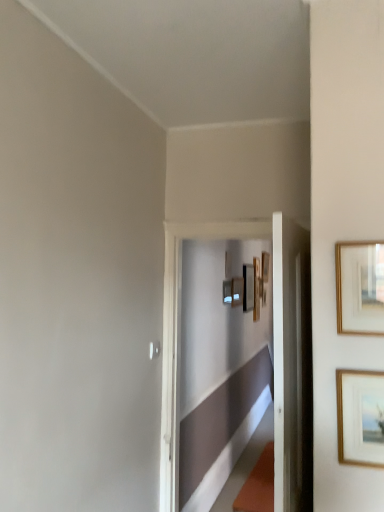
From the picture: Measure the distance between matte black picture frame at center, which is the third picture frame from front to back, and camera.

The distance of matte black picture frame at center, which is the third picture frame from front to back, from camera is 4.00 meters.

Locate an element on the screen. wooden picture frame at center, which ranks as the 1th picture frame in back-to-front order is located at coordinates (256, 289).

This screenshot has height=512, width=384. Find the location of `matte black picture frame at center, which appears as the 5th picture frame when viewed from the front`. matte black picture frame at center, which appears as the 5th picture frame when viewed from the front is located at coordinates (248, 287).

In order to click on gold-framed picture at right, the first picture frame when ordered from front to back in this screenshot , I will do `click(359, 417)`.

Where is `matte black picture frame at center, which is counted as the 4th picture frame, starting from the back`? This screenshot has width=384, height=512. matte black picture frame at center, which is counted as the 4th picture frame, starting from the back is located at coordinates (227, 291).

From the image's perspective, is wooden picture frame at center, the fourth picture frame when ordered from front to back, above or below wooden picture frame at center, which ranks as the 1th picture frame in back-to-front order?

wooden picture frame at center, the fourth picture frame when ordered from front to back, is situated higher than wooden picture frame at center, which ranks as the 1th picture frame in back-to-front order, in the image.

Considering the relative sizes of wooden picture frame at center, which appears as the third picture frame when viewed from the back, and wooden picture frame at center, which ranks as the 1th picture frame in back-to-front order, in the image provided, is wooden picture frame at center, which appears as the third picture frame when viewed from the back, thinner than wooden picture frame at center, which ranks as the 1th picture frame in back-to-front order,?

Yes.

From a real-world perspective, is wooden picture frame at center, the fourth picture frame when ordered from front to back, physically below wooden picture frame at center, the sixth picture frame when ordered from front to back?

No, from a real-world perspective, wooden picture frame at center, the fourth picture frame when ordered from front to back, is not under wooden picture frame at center, the sixth picture frame when ordered from front to back.

Can you confirm if gold-framed picture at right, the first picture frame when ordered from front to back, is wider than matte black picture frame at center, the second picture frame when ordered from back to front?

Incorrect, the width of gold-framed picture at right, the first picture frame when ordered from front to back, does not surpass that of matte black picture frame at center, the second picture frame when ordered from back to front.

Does gold-framed picture at right, the first picture frame when ordered from front to back, appear on the left side of matte black picture frame at center, which appears as the 5th picture frame when viewed from the front?

Yes.

Is gold-framed picture at right, the 6th picture frame from the back, positioned with its back to matte black picture frame at center, the second picture frame when ordered from back to front?

Yes, matte black picture frame at center, the second picture frame when ordered from back to front, is at the back of gold-framed picture at right, the 6th picture frame from the back.

Would you say gold-framed picture at right, the 6th picture frame from the back, is inside or outside matte black picture frame at center, which appears as the 5th picture frame when viewed from the front?

gold-framed picture at right, the 6th picture frame from the back, is not enclosed by matte black picture frame at center, which appears as the 5th picture frame when viewed from the front.

Is gold-framed picture at right, the 6th picture frame from the back, taller than wooden picture frame at center, the sixth picture frame when ordered from front to back?

No.

Who is more distant, gold-framed picture at right, the first picture frame when ordered from front to back, or wooden picture frame at center, the sixth picture frame when ordered from front to back?

wooden picture frame at center, the sixth picture frame when ordered from front to back, is behind.

Which is less distant, (356, 412) or (253, 320)?

Point (356, 412)

Are gold-framed picture at right, the first picture frame when ordered from front to back, and gold-framed picture at upper right, marked as the 2th picture frame in a front-to-back arrangement, beside each other?

gold-framed picture at right, the first picture frame when ordered from front to back, and gold-framed picture at upper right, marked as the 2th picture frame in a front-to-back arrangement, are not in contact.

Would you say gold-framed picture at right, the 6th picture frame from the back, is to the left or to the right of gold-framed picture at upper right, positioned as the 5th picture frame in back-to-front order, in the picture?

gold-framed picture at right, the 6th picture frame from the back, is to the left of gold-framed picture at upper right, positioned as the 5th picture frame in back-to-front order.

From the gold-framed picture at right, the first picture frame when ordered from front to back, count 1st picture frames backward and point to it. Please provide its 2D coordinates.

[(360, 287)]

Between gold-framed picture at right, the first picture frame when ordered from front to back, and gold-framed picture at upper right, positioned as the 5th picture frame in back-to-front order, which one is positioned in front?

gold-framed picture at right, the first picture frame when ordered from front to back.

Considering the sizes of objects wooden picture frame at center, the fourth picture frame when ordered from front to back, and matte black picture frame at center, which is counted as the 4th picture frame, starting from the back, in the image provided, who is wider, wooden picture frame at center, the fourth picture frame when ordered from front to back, or matte black picture frame at center, which is counted as the 4th picture frame, starting from the back,?

Wider between the two is wooden picture frame at center, the fourth picture frame when ordered from front to back.

Can you tell me how much wooden picture frame at center, which appears as the third picture frame when viewed from the back, and matte black picture frame at center, which is the third picture frame from front to back, differ in facing direction?

0.0101 degrees.

Is point (241, 290) in front of point (226, 297)?

No.

Does wooden picture frame at center, which appears as the third picture frame when viewed from the back, have a smaller size compared to matte black picture frame at center, which is the third picture frame from front to back?

No, wooden picture frame at center, which appears as the third picture frame when viewed from the back, is not smaller than matte black picture frame at center, which is the third picture frame from front to back.

From a real-world perspective, which picture frame is the 1st one above the gold-framed picture at right, the first picture frame when ordered from front to back? Please provide its 2D coordinates.

[(227, 291)]

Is point (356, 434) farther from camera compared to point (225, 286)?

No, it is in front of (225, 286).

Is gold-framed picture at right, the 6th picture frame from the back, taller or shorter than matte black picture frame at center, which is counted as the 4th picture frame, starting from the back?

gold-framed picture at right, the 6th picture frame from the back, is taller than matte black picture frame at center, which is counted as the 4th picture frame, starting from the back.

Can you tell me how much matte black picture frame at center, which is the third picture frame from front to back, and matte black picture frame at center, which appears as the 5th picture frame when viewed from the front, differ in facing direction?

The angle between the facing direction of matte black picture frame at center, which is the third picture frame from front to back, and the facing direction of matte black picture frame at center, which appears as the 5th picture frame when viewed from the front, is 0.0116 degrees.

From a real-world perspective, is matte black picture frame at center, which is the third picture frame from front to back, physically below matte black picture frame at center, the second picture frame when ordered from back to front?

Yes, from a real-world perspective, matte black picture frame at center, which is the third picture frame from front to back, is below matte black picture frame at center, the second picture frame when ordered from back to front.

Is matte black picture frame at center, which is counted as the 4th picture frame, starting from the back, positioned with its back to matte black picture frame at center, the second picture frame when ordered from back to front?

No, matte black picture frame at center, which is counted as the 4th picture frame, starting from the back, is not facing away from matte black picture frame at center, the second picture frame when ordered from back to front.

Locate an element on the screen. The height and width of the screenshot is (512, 384). picture frame that is the 1st object located below the wooden picture frame at center, the fourth picture frame when ordered from front to back (from the image's perspective) is located at coordinates (256, 289).

Find the location of `picture frame that is the 3rd one when counting upward from the gold-framed picture at right, the first picture frame when ordered from front to back (from the image's perspective)`. picture frame that is the 3rd one when counting upward from the gold-framed picture at right, the first picture frame when ordered from front to back (from the image's perspective) is located at coordinates (248, 287).

Looking at the image, which one is located closer to matte black picture frame at center, which is the third picture frame from front to back, gold-framed picture at upper right, marked as the 2th picture frame in a front-to-back arrangement, or wooden picture frame at center, the fourth picture frame when ordered from front to back?

The object closer to matte black picture frame at center, which is the third picture frame from front to back, is wooden picture frame at center, the fourth picture frame when ordered from front to back.

Considering their positions, is wooden picture frame at center, the fourth picture frame when ordered from front to back, positioned closer to matte black picture frame at center, which is counted as the 4th picture frame, starting from the back, than gold-framed picture at right, the 6th picture frame from the back?

Among the two, wooden picture frame at center, the fourth picture frame when ordered from front to back, is located nearer to matte black picture frame at center, which is counted as the 4th picture frame, starting from the back.

Estimate the real-world distances between objects in this image. Which object is further from wooden picture frame at center, the sixth picture frame when ordered from front to back, wooden picture frame at center, the fourth picture frame when ordered from front to back, or matte black picture frame at center, which appears as the 5th picture frame when viewed from the front?

wooden picture frame at center, the fourth picture frame when ordered from front to back.

Considering their positions, is matte black picture frame at center, which is counted as the 4th picture frame, starting from the back, positioned further to gold-framed picture at upper right, marked as the 2th picture frame in a front-to-back arrangement, than matte black picture frame at center, which appears as the 5th picture frame when viewed from the front?

matte black picture frame at center, which appears as the 5th picture frame when viewed from the front, is positioned further to the anchor gold-framed picture at upper right, marked as the 2th picture frame in a front-to-back arrangement.

From the image, which object appears to be farther from matte black picture frame at center, which appears as the 5th picture frame when viewed from the front, wooden picture frame at center, which appears as the third picture frame when viewed from the back, or matte black picture frame at center, which is counted as the 4th picture frame, starting from the back?

matte black picture frame at center, which is counted as the 4th picture frame, starting from the back, is positioned further to the anchor matte black picture frame at center, which appears as the 5th picture frame when viewed from the front.

Based on their spatial positions, is wooden picture frame at center, the fourth picture frame when ordered from front to back, or matte black picture frame at center, the second picture frame when ordered from back to front, closer to matte black picture frame at center, which is the third picture frame from front to back?

wooden picture frame at center, the fourth picture frame when ordered from front to back, is closer to matte black picture frame at center, which is the third picture frame from front to back.

From the picture: Looking at the image, which one is located further to matte black picture frame at center, which is the third picture frame from front to back, gold-framed picture at upper right, marked as the 2th picture frame in a front-to-back arrangement, or matte black picture frame at center, the second picture frame when ordered from back to front?

Based on the image, gold-framed picture at upper right, marked as the 2th picture frame in a front-to-back arrangement, appears to be further to matte black picture frame at center, which is the third picture frame from front to back.

Estimate the real-world distances between objects in this image. Which object is further from gold-framed picture at right, the 6th picture frame from the back, matte black picture frame at center, which appears as the 5th picture frame when viewed from the front, or matte black picture frame at center, which is counted as the 4th picture frame, starting from the back?

The object further to gold-framed picture at right, the 6th picture frame from the back, is matte black picture frame at center, which appears as the 5th picture frame when viewed from the front.

The image size is (384, 512). I want to click on picture frame positioned between wooden picture frame at center, which appears as the third picture frame when viewed from the back, and wooden picture frame at center, the sixth picture frame when ordered from front to back, from near to far, so [x=248, y=287].

Locate an element on the screen. This screenshot has width=384, height=512. picture frame between gold-framed picture at upper right, positioned as the 5th picture frame in back-to-front order, and wooden picture frame at center, the fourth picture frame when ordered from front to back, from front to back is located at coordinates (227, 291).

This screenshot has width=384, height=512. Find the location of `picture frame between matte black picture frame at center, which is the third picture frame from front to back, and matte black picture frame at center, the second picture frame when ordered from back to front, along the z-axis`. picture frame between matte black picture frame at center, which is the third picture frame from front to back, and matte black picture frame at center, the second picture frame when ordered from back to front, along the z-axis is located at coordinates (237, 291).

The width and height of the screenshot is (384, 512). Find the location of `picture frame located between gold-framed picture at right, the first picture frame when ordered from front to back, and matte black picture frame at center, which is counted as the 4th picture frame, starting from the back, in the depth direction`. picture frame located between gold-framed picture at right, the first picture frame when ordered from front to back, and matte black picture frame at center, which is counted as the 4th picture frame, starting from the back, in the depth direction is located at coordinates (360, 287).